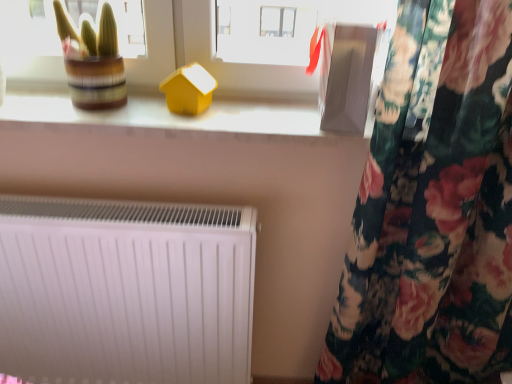
Identify the location of vacant area located to the right-hand side of green striped pot at upper left. (150, 114).